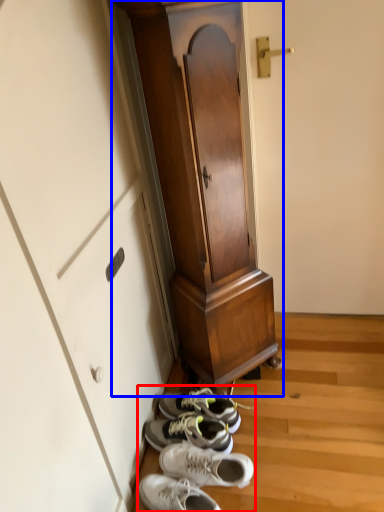
Question: Which point is closer to the camera, shoe (highlighted by a red box) or furniture (highlighted by a blue box)?

Choices:
 (A) shoe
 (B) furniture

Answer: (B)